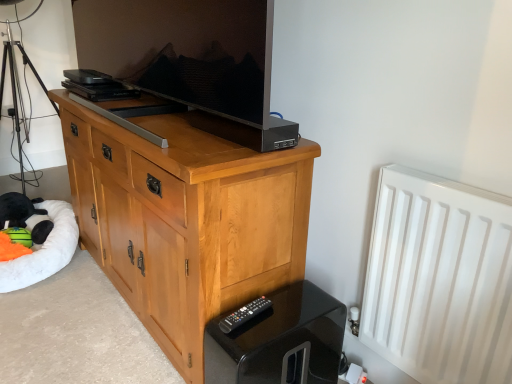
Question: Considering the positions of black plush toy at lower left and black glossy remote control at lower right in the image, is black plush toy at lower left wider or thinner than black glossy remote control at lower right?

Choices:
 (A) wide
 (B) thin

Answer: (B)

Question: Considering the positions of black plush toy at lower left and black glossy remote control at lower right in the image, is black plush toy at lower left taller or shorter than black glossy remote control at lower right?

Choices:
 (A) short
 (B) tall

Answer: (A)

Question: Which object is the closest to the white matte radiator at right?

Choices:
 (A) light wood cabinet at center
 (B) black plastic remote at lower center
 (C) black glossy remote control at lower right
 (D) black metal tripod at left
 (E) black plush toy at lower left

Answer: (C)

Question: Which of these objects is positioned farthest from the matte black television at center?

Choices:
 (A) black glossy remote control at lower right
 (B) white matte radiator at right
 (C) light wood cabinet at center
 (D) black plush toy at lower left
 (E) black plastic remote at lower center

Answer: (D)